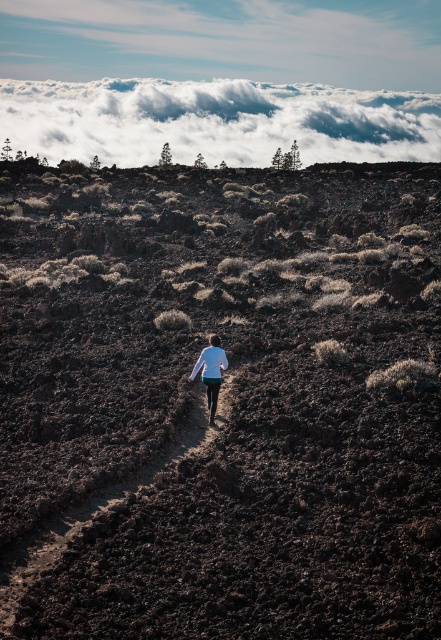
Between point (347, 524) and point (12, 122), which one is positioned behind?

The point (12, 122) is behind.

Does dull brown soil at center lie in front of white fluffy cloud at upper center?

Yes, it is in front of white fluffy cloud at upper center.

The height and width of the screenshot is (640, 441). What do you see at coordinates (230, 397) in the screenshot? I see `dull brown soil at center` at bounding box center [230, 397].

The height and width of the screenshot is (640, 441). What are the coordinates of `dull brown soil at center` in the screenshot? It's located at (230, 397).

In the scene shown: Is dirt path at center bigger than white matte shirt at center?

Yes.

Who is lower down, dirt path at center or white matte shirt at center?

Positioned lower is dirt path at center.

Identify the location of dirt path at center. (88, 541).

At what (x,y) coordinates should I click in order to perform the action: click on dirt path at center. Please return your answer as a coordinate pair (x, y). The image size is (441, 640). Looking at the image, I should click on (88, 541).

Can you confirm if dull brown soil at center is smaller than white matte shirt at center?

No.

Can you confirm if dull brown soil at center is positioned to the left of white matte shirt at center?

Yes, dull brown soil at center is to the left of white matte shirt at center.

Who is more distant from viewer, [215,195] or [209,422]?

Point [215,195]

Locate an element on the screen. The image size is (441, 640). dull brown soil at center is located at coordinates (230, 397).